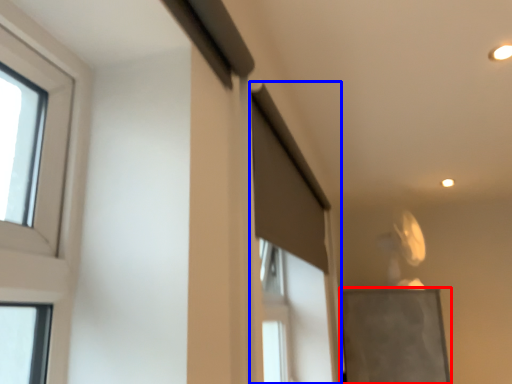
Question: Which object appears closest to the camera in this image, bulletin board (highlighted by a red box) or screen door (highlighted by a blue box)?

Choices:
 (A) bulletin board
 (B) screen door

Answer: (B)